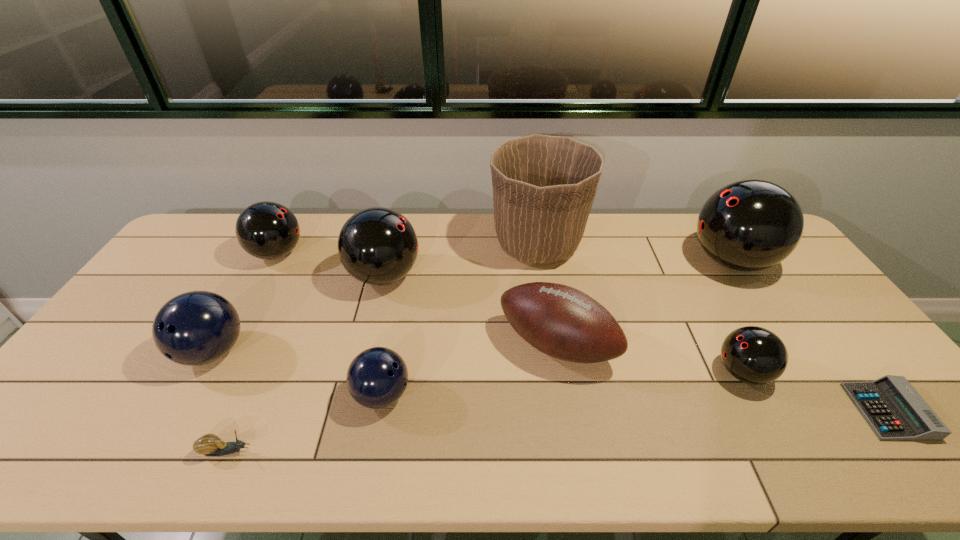
At what (x,y) coordinates should I click in order to perform the action: click on flowerpot. Please return your answer as a coordinate pair (x, y). The width and height of the screenshot is (960, 540). Looking at the image, I should click on (544, 186).

Find the location of a particular element. This screenshot has height=540, width=960. the second tallest object is located at coordinates (749, 225).

Identify the location of the biggest black bowling ball. This screenshot has height=540, width=960. (749, 225).

At what (x,y) coordinates should I click in order to perform the action: click on the second black bowling ball from left to right. Please return your answer as a coordinate pair (x, y). The height and width of the screenshot is (540, 960). Looking at the image, I should click on (378, 246).

Find the location of a particular element. the second tallest bowling ball is located at coordinates (378, 246).

Where is `the second smallest black bowling ball`? the second smallest black bowling ball is located at coordinates (267, 230).

Identify the location of the bigger blue bowling ball. click(194, 328).

The height and width of the screenshot is (540, 960). What are the coordinates of `brown football (American)` in the screenshot? It's located at (560, 321).

The height and width of the screenshot is (540, 960). Find the location of `the right blue bowling ball`. the right blue bowling ball is located at coordinates (377, 377).

Find the location of `the smallest black bowling ball`. the smallest black bowling ball is located at coordinates (754, 355).